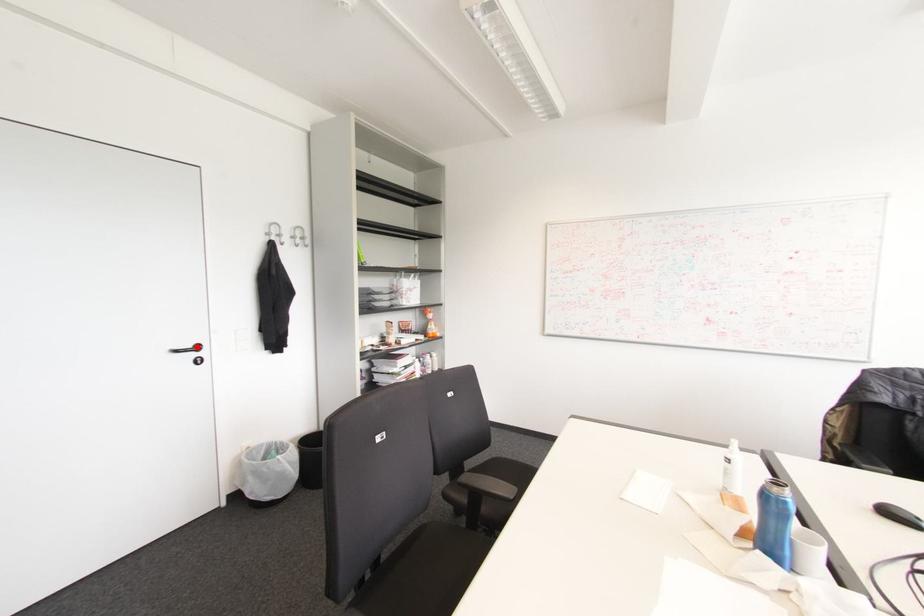
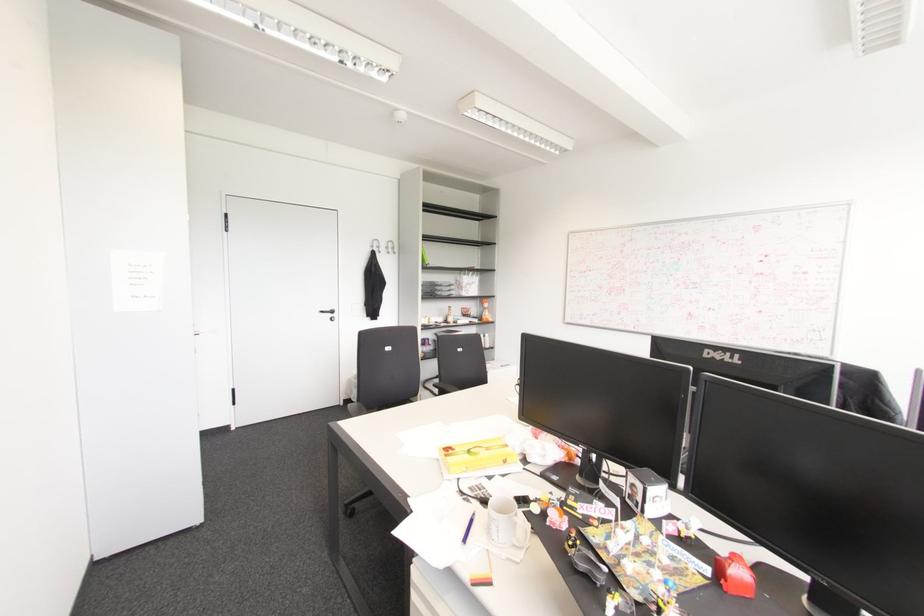
Question: I am providing you with two images of the same scene from different viewpoints. A red point is marked on the first image. Can you still see the location of the red point in image 2?

Choices:
 (A) Yes
 (B) No

Answer: (A)